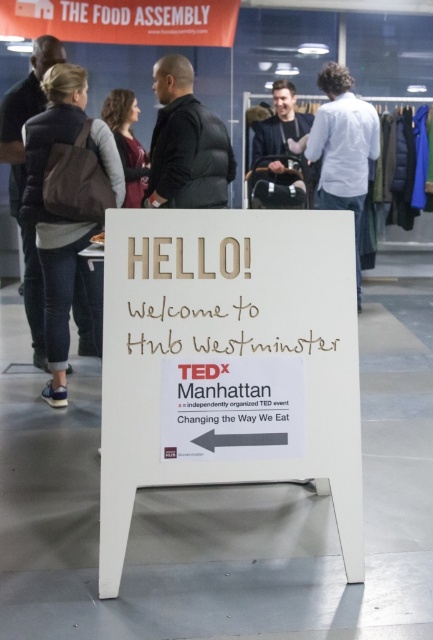
Question: Is white shirt at upper right further to camera compared to matte gray sweater at upper left?

Choices:
 (A) no
 (B) yes

Answer: (B)

Question: Which of the following is the closest to the observer?

Choices:
 (A) white cardboard sign at center
 (B) denim jacket at left
 (C) matte gray sweater at upper left
 (D) black puffer jacket at center

Answer: (A)

Question: Based on their relative distances, which object is farther from the white shirt at upper right?

Choices:
 (A) matte gray sweater at upper left
 (B) black puffer jacket at center
 (C) denim jacket at left
 (D) white cardboard sign at center

Answer: (D)

Question: Does white cardboard sign at center have a lesser width compared to matte black jacket at center?

Choices:
 (A) no
 (B) yes

Answer: (A)

Question: Based on their relative distances, which object is nearer to the black puffer jacket at center?

Choices:
 (A) matte gray sweater at upper left
 (B) white shirt at upper right
 (C) dark brown leather jacket at left

Answer: (C)

Question: Can you confirm if white cardboard sign at center is bigger than dark brown leather jacket at left?

Choices:
 (A) no
 (B) yes

Answer: (A)